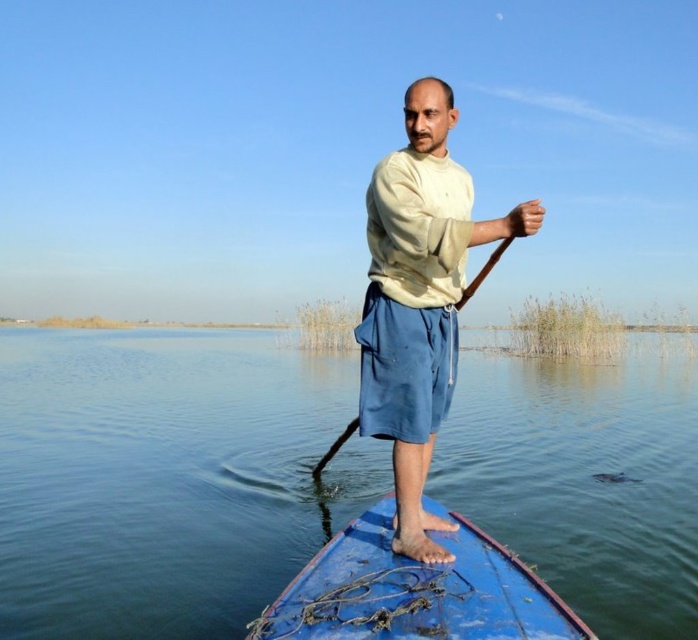
You are standing on the deck of a ship that is 10 meters long. You see a point at coordinates point (8, 413). If the ship is facing north, and the point is located 16.61 meters away from you, can you safely move the ship forward without hitting anything?

The point at point (8, 413) is 16.61 meters away from the camera. Since the ship is 10 meters long, moving it forward would leave 6.61 meters of clearance between the ship and the point, so yes, you can safely move the ship forward without hitting anything.

You are standing on the shore of a lake and see a man in a beige cotton shirt at center paddling a boat. If you want to throw him a life jacket, which is 15 feet away from you, will it reach him?

The distance between the beige cotton shirt at center and the viewer is 12.48 feet, so yes, the life jacket thrown from 15 feet away will reach him.